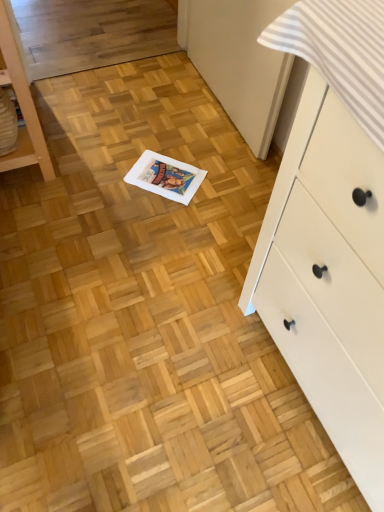
The height and width of the screenshot is (512, 384). I want to click on white wood chest of drawers at right, so point(329,250).

Image resolution: width=384 pixels, height=512 pixels. What do you see at coordinates (329, 250) in the screenshot?
I see `white wood chest of drawers at right` at bounding box center [329, 250].

Identify the location of white wood chest of drawers at right. The width and height of the screenshot is (384, 512). (329, 250).